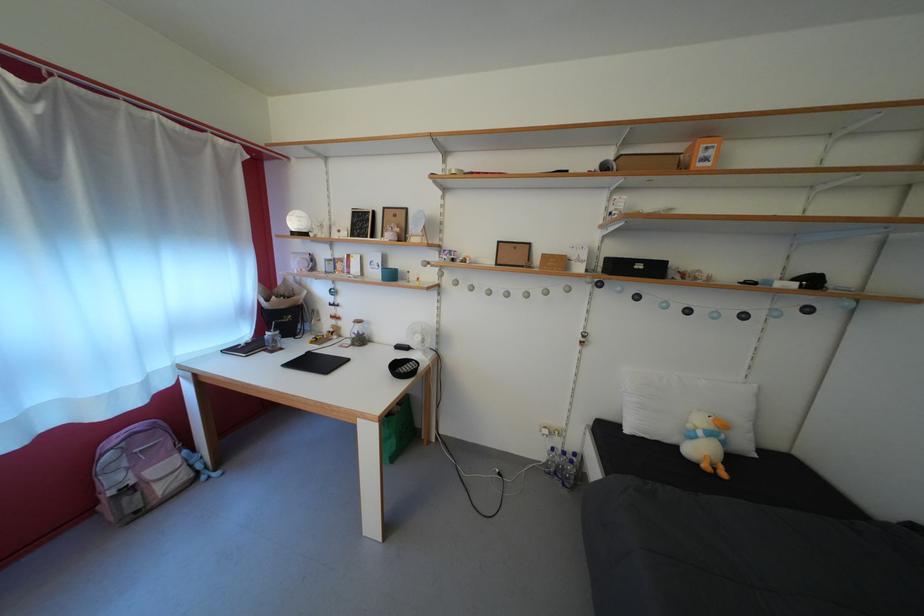
At what (x,y) coordinates should I click in order to perform the action: click on white pillow. Please return your answer as a coordinate pair (x, y). The image size is (924, 616). Looking at the image, I should click on (687, 406).